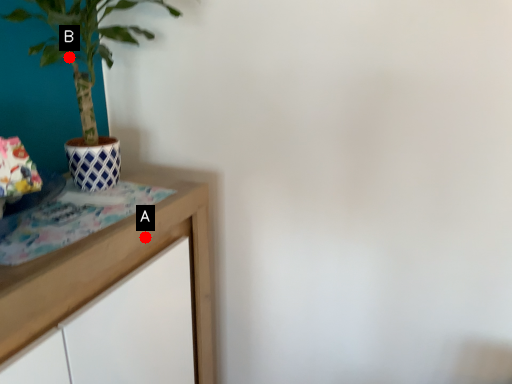
Question: Two points are circled on the image, labeled by A and B beside each circle. Which of the following is the farthest from the observer?

Choices:
 (A) A is further
 (B) B is further

Answer: (B)